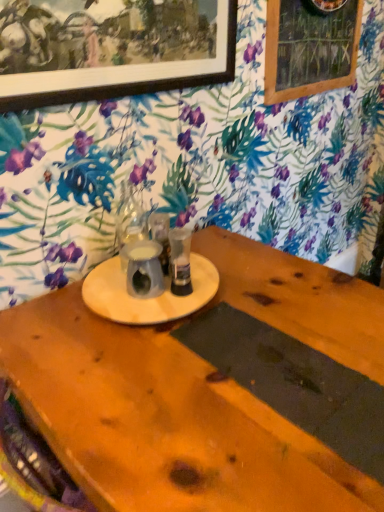
The height and width of the screenshot is (512, 384). In order to click on vacant space in front of metallic silver cup at center, the 1th tableware from the right in this screenshot , I will do `click(152, 308)`.